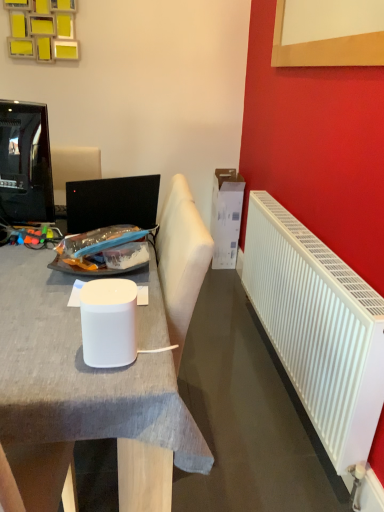
Question: From the image's perspective, is white glossy paper cup at center under white plastic radiator at right?

Choices:
 (A) yes
 (B) no

Answer: (B)

Question: From a real-world perspective, does white glossy paper cup at center sit lower than white plastic radiator at right?

Choices:
 (A) no
 (B) yes

Answer: (A)

Question: Can you confirm if white glossy paper cup at center is positioned to the left of white plastic radiator at right?

Choices:
 (A) no
 (B) yes

Answer: (B)

Question: Does white glossy paper cup at center have a larger size compared to white plastic radiator at right?

Choices:
 (A) yes
 (B) no

Answer: (B)

Question: Is white glossy paper cup at center oriented towards white plastic radiator at right?

Choices:
 (A) no
 (B) yes

Answer: (A)

Question: Relative to white cardboard box at upper right, is white plastic radiator at right in front or behind?

Choices:
 (A) behind
 (B) front

Answer: (B)

Question: Is white plastic radiator at right spatially inside white cardboard box at upper right, or outside of it?

Choices:
 (A) outside
 (B) inside

Answer: (A)

Question: From a real-world perspective, relative to white cardboard box at upper right, is white plastic radiator at right vertically above or below?

Choices:
 (A) below
 (B) above

Answer: (B)

Question: In terms of width, does white plastic radiator at right look wider or thinner when compared to white cardboard box at upper right?

Choices:
 (A) wide
 (B) thin

Answer: (B)

Question: Based on their sizes in the image, would you say white glossy paper cup at center is bigger or smaller than white plastic radiator at right?

Choices:
 (A) small
 (B) big

Answer: (A)

Question: Is white glossy paper cup at center in front of or behind white plastic radiator at right in the image?

Choices:
 (A) behind
 (B) front

Answer: (B)

Question: Is white glossy paper cup at center to the left or to the right of white plastic radiator at right in the image?

Choices:
 (A) left
 (B) right

Answer: (A)

Question: Is point (119, 297) closer or farther from the camera than point (253, 221)?

Choices:
 (A) farther
 (B) closer

Answer: (B)

Question: From the image's perspective, is white plastic radiator at right positioned above or below white glossy paper cup at center?

Choices:
 (A) above
 (B) below

Answer: (B)

Question: Based on their sizes in the image, would you say white plastic radiator at right is bigger or smaller than white glossy paper cup at center?

Choices:
 (A) big
 (B) small

Answer: (A)